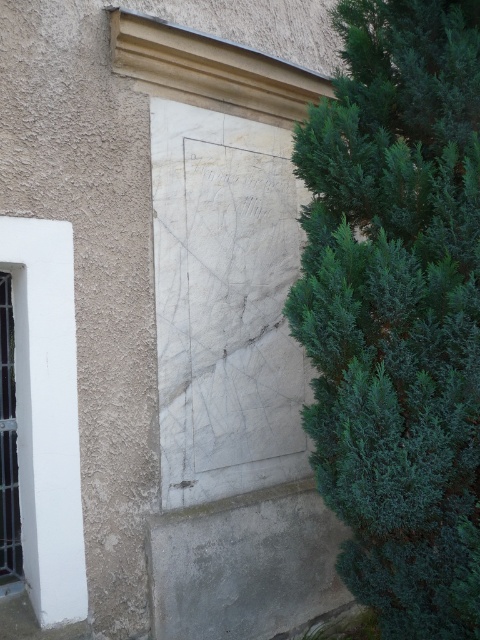
Is point (15, 237) in front of point (0, 378)?

Yes, it is in front of point (0, 378).

Who is lower down, white matte window at left or clear glass window at left?

clear glass window at left

Measure the distance between point (x=33, y=476) and camera.

Point (x=33, y=476) is 9.71 feet away from camera.

Find the location of a particular element. The height and width of the screenshot is (640, 480). white matte window at left is located at coordinates (47, 413).

Who is taller, green leafy bush at right or white matte window at left?

green leafy bush at right

Can you confirm if green leafy bush at right is positioned below white matte window at left?

Actually, green leafy bush at right is above white matte window at left.

Between point (468, 61) and point (63, 532), which one is positioned in front?

Point (468, 61) is in front.

The height and width of the screenshot is (640, 480). Find the location of `green leafy bush at right`. green leafy bush at right is located at coordinates (397, 308).

Who is taller, green leafy bush at right or clear glass window at left?

With more height is green leafy bush at right.

Consider the image. Between green leafy bush at right and clear glass window at left, which one appears on the right side from the viewer's perspective?

From the viewer's perspective, green leafy bush at right appears more on the right side.

Image resolution: width=480 pixels, height=640 pixels. Describe the element at coordinates (397, 308) in the screenshot. I see `green leafy bush at right` at that location.

Identify the location of green leafy bush at right. The image size is (480, 640). (397, 308).